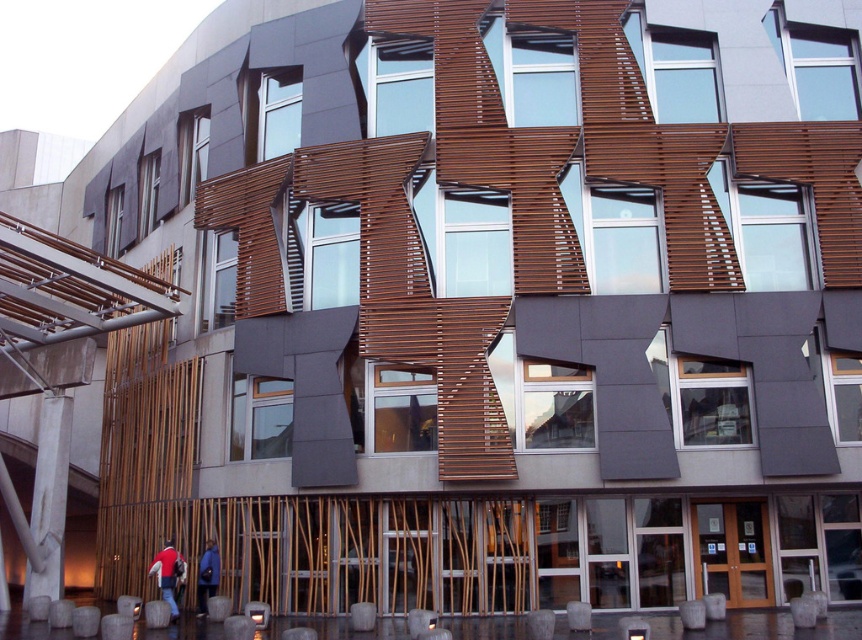
Is red fabric jacket at lower left smaller than blue fabric jacket at lower center?

No, red fabric jacket at lower left is not smaller than blue fabric jacket at lower center.

Which is behind, point (182, 572) or point (216, 552)?

The point (216, 552) is behind.

Find the location of a particular element. Image resolution: width=862 pixels, height=640 pixels. red fabric jacket at lower left is located at coordinates (167, 573).